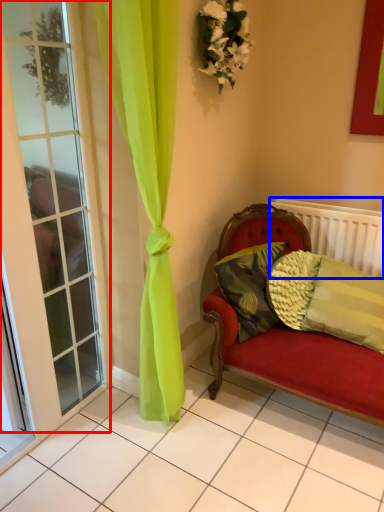
Question: Which object is further to the camera taking this photo, window (highlighted by a red box) or radiator (highlighted by a blue box)?

Choices:
 (A) window
 (B) radiator

Answer: (B)